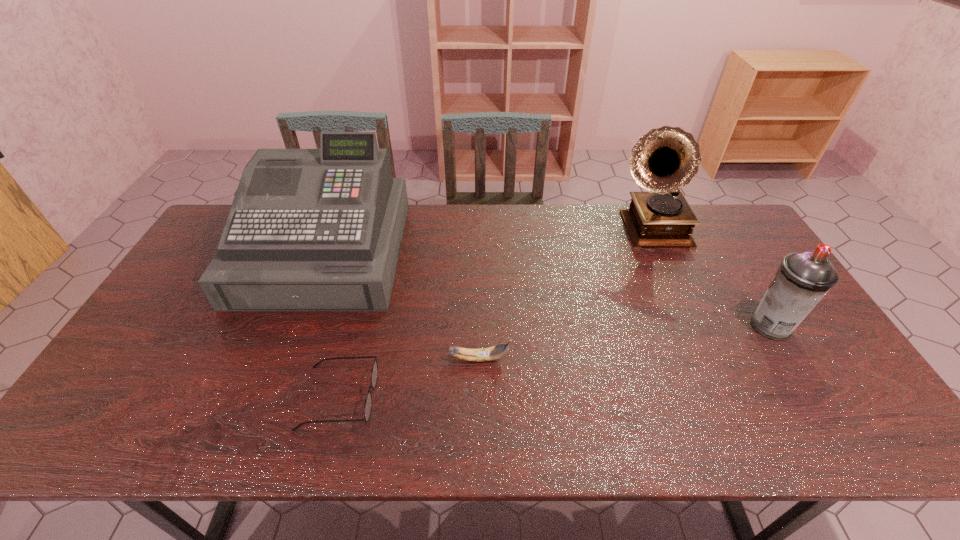
At what (x,y) coordinates should I click in order to perform the action: click on vacant space situated 0.190m on the left of the aerosol can. Please return your answer as a coordinate pair (x, y). The image size is (960, 540). Looking at the image, I should click on (681, 326).

Locate an element on the screen. The image size is (960, 540). vacant space located at the stem of the banana is located at coordinates (529, 359).

Locate an element on the screen. The height and width of the screenshot is (540, 960). vacant region located on the front-facing side of the nearest object is located at coordinates (501, 397).

This screenshot has width=960, height=540. Find the location of `record player positioned at the far edge`. record player positioned at the far edge is located at coordinates (665, 159).

At what (x,y) coordinates should I click in order to perform the action: click on cash register that is at the far edge. Please return your answer as a coordinate pair (x, y). The image size is (960, 540). Looking at the image, I should click on (321, 229).

Identify the location of object located at the near edge. The height and width of the screenshot is (540, 960). (374, 373).

Identify the location of object located at the left edge. Image resolution: width=960 pixels, height=540 pixels. point(321,229).

The image size is (960, 540). I want to click on object present at the right edge, so click(803, 279).

You are a GUI agent. You are given a task and a screenshot of the screen. Output one action in this format:
    pyautogui.click(x=<x>, y=<y>)
    Task: Click on the object situated at the far left corner
    
    Given the screenshot: What is the action you would take?
    pyautogui.click(x=321, y=229)

In the image, there is a desktop. In order to click on vacant area at the far edge in this screenshot , I will do `click(609, 214)`.